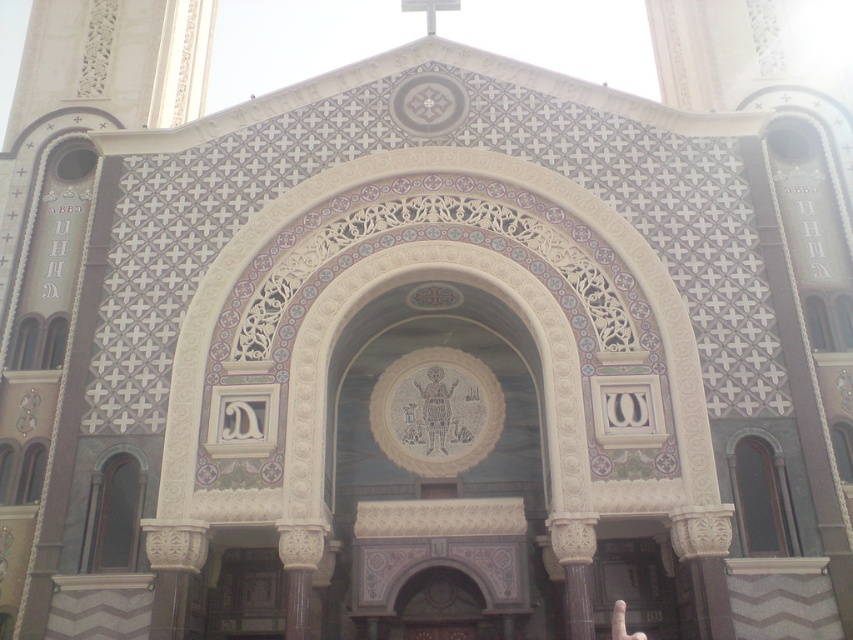
Question: Which object is positioned farthest from the white matte finger at lower right?

Choices:
 (A) white glossy cross at upper center
 (B) transparent glass door at left

Answer: (A)

Question: Is transparent glass door at left wider than white glossy cross at upper center?

Choices:
 (A) no
 (B) yes

Answer: (A)

Question: Which point appears closest to the camera in this image?

Choices:
 (A) (113, 554)
 (B) (434, 16)
 (C) (616, 634)

Answer: (C)

Question: Which point is farther to the camera?

Choices:
 (A) transparent glass door at left
 (B) white glossy cross at upper center
 (C) white matte finger at lower right

Answer: (B)

Question: Does transparent glass door at left have a smaller size compared to white matte finger at lower right?

Choices:
 (A) no
 (B) yes

Answer: (B)

Question: Does white glossy cross at upper center lie behind white matte finger at lower right?

Choices:
 (A) yes
 (B) no

Answer: (A)